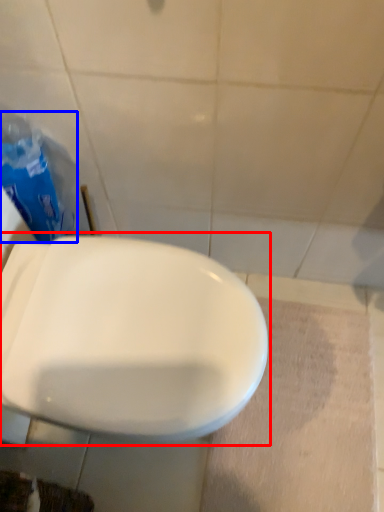
Question: Which object appears closest to the camera in this image, toilet (highlighted by a red box) or garbage (highlighted by a blue box)?

Choices:
 (A) toilet
 (B) garbage

Answer: (A)